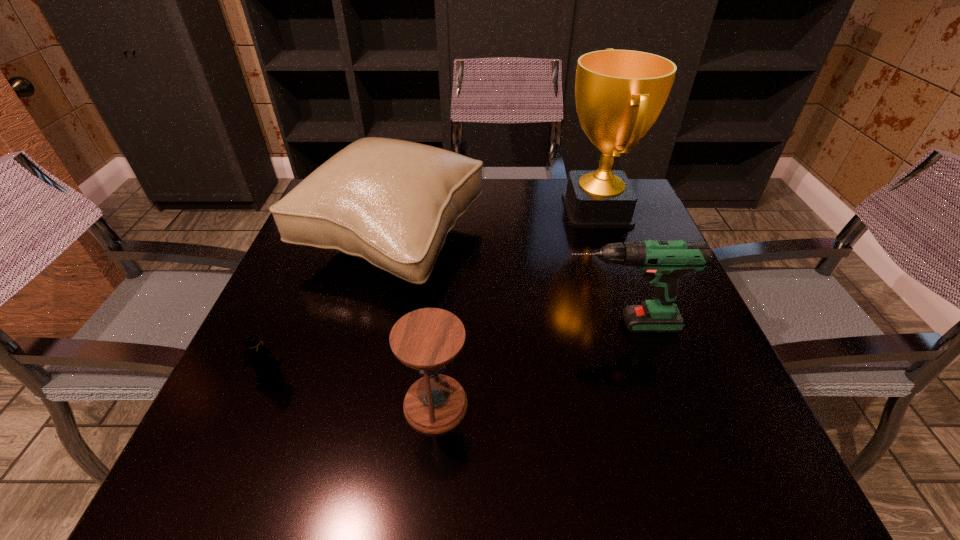
The image size is (960, 540). What are the coordinates of `object that is at the far left corner` in the screenshot? It's located at click(391, 202).

Find the location of a particular element. The image size is (960, 540). object at the far right corner is located at coordinates (619, 94).

This screenshot has height=540, width=960. What are the coordinates of `vacant space at the far edge` in the screenshot? It's located at (556, 181).

Image resolution: width=960 pixels, height=540 pixels. I want to click on vacant point at the near edge, so click(605, 467).

You are a GUI agent. You are given a task and a screenshot of the screen. Output one action in this format:
    pyautogui.click(x=<x>, y=<y>)
    Task: Click on the vacant space at the left edge of the desktop
    The height and width of the screenshot is (540, 960).
    Given the screenshot: What is the action you would take?
    pyautogui.click(x=356, y=265)

In order to click on free point at the right edge in this screenshot , I will do `click(697, 322)`.

Where is `free spot at the near left corner of the desktop`? The width and height of the screenshot is (960, 540). free spot at the near left corner of the desktop is located at coordinates (194, 463).

Locate an element on the screen. Image resolution: width=960 pixels, height=540 pixels. empty space that is in between the shortest object and the cushion is located at coordinates (331, 308).

Where is `unoccupied position between the award and the drill`? This screenshot has height=540, width=960. unoccupied position between the award and the drill is located at coordinates click(608, 267).

I want to click on free spot between the award and the cushion, so click(x=494, y=225).